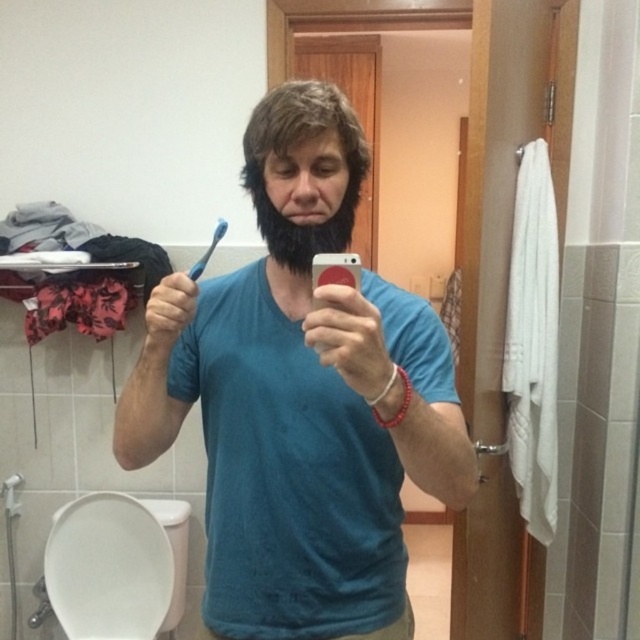
You are a dental hygienist who needs to hand the blue matte toothbrush at center to a patient standing 30 inches away. Can you reach them without moving?

The blue matte toothbrush at center and the viewer are 29.99 inches apart, so yes, the dental hygienist can reach the patient since the distance is just under 30 inches.